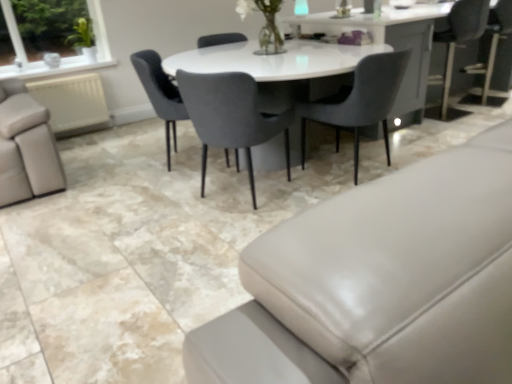
Question: From a real-world perspective, does matte gray chair at center, which appears as the first chair when viewed from the left, stand above velvet grey chair at center, the 3th chair in the left-to-right sequence?

Choices:
 (A) no
 (B) yes

Answer: (B)

Question: Is the depth of matte gray chair at center, which appears as the first chair when viewed from the left, greater than that of velvet grey chair at center, the 3th chair in the left-to-right sequence?

Choices:
 (A) no
 (B) yes

Answer: (B)

Question: Is matte gray chair at center, which is counted as the 3th chair, starting from the right, taller than velvet grey chair at center, the 3th chair in the left-to-right sequence?

Choices:
 (A) no
 (B) yes

Answer: (B)

Question: Does matte gray chair at center, which is counted as the 3th chair, starting from the right, lie in front of velvet grey chair at center, which is the first chair in right-to-left order?

Choices:
 (A) no
 (B) yes

Answer: (A)

Question: Are matte gray chair at center, which appears as the first chair when viewed from the left, and velvet grey chair at center, which is the first chair in right-to-left order, far apart?

Choices:
 (A) yes
 (B) no

Answer: (A)

Question: Is velvet grey chair at center, which is the first chair in right-to-left order, situated inside matte gray couch at lower right or outside?

Choices:
 (A) inside
 (B) outside

Answer: (B)

Question: From a real-world perspective, is velvet grey chair at center, the 3th chair in the left-to-right sequence, physically located above or below matte gray couch at lower right?

Choices:
 (A) above
 (B) below

Answer: (A)

Question: Based on their sizes in the image, would you say velvet grey chair at center, the 3th chair in the left-to-right sequence, is bigger or smaller than matte gray couch at lower right?

Choices:
 (A) big
 (B) small

Answer: (B)

Question: Is point [396, 77] closer or farther from the camera than point [436, 185]?

Choices:
 (A) closer
 (B) farther

Answer: (B)

Question: Relative to matte gray chair at center, which appears as the first chair when viewed from the left, is velvet grey chair at center, acting as the second chair starting from the left, in front or behind?

Choices:
 (A) front
 (B) behind

Answer: (A)

Question: Is point (247, 142) closer or farther from the camera than point (168, 134)?

Choices:
 (A) closer
 (B) farther

Answer: (A)

Question: Considering the positions of velvet grey chair at center, acting as the second chair starting from the left, and matte gray chair at center, which is counted as the 3th chair, starting from the right, in the image, is velvet grey chair at center, acting as the second chair starting from the left, taller or shorter than matte gray chair at center, which is counted as the 3th chair, starting from the right,?

Choices:
 (A) tall
 (B) short

Answer: (A)

Question: Is velvet grey chair at center, acting as the second chair starting from the left, wider or thinner than matte gray chair at center, which appears as the first chair when viewed from the left?

Choices:
 (A) wide
 (B) thin

Answer: (A)

Question: In terms of height, does matte gray chair at center, which appears as the first chair when viewed from the left, look taller or shorter compared to velvet grey chair at center, the 3th chair in the left-to-right sequence?

Choices:
 (A) short
 (B) tall

Answer: (B)

Question: Do you think matte gray chair at center, which appears as the first chair when viewed from the left, is within velvet grey chair at center, which is the first chair in right-to-left order, or outside of it?

Choices:
 (A) inside
 (B) outside

Answer: (B)